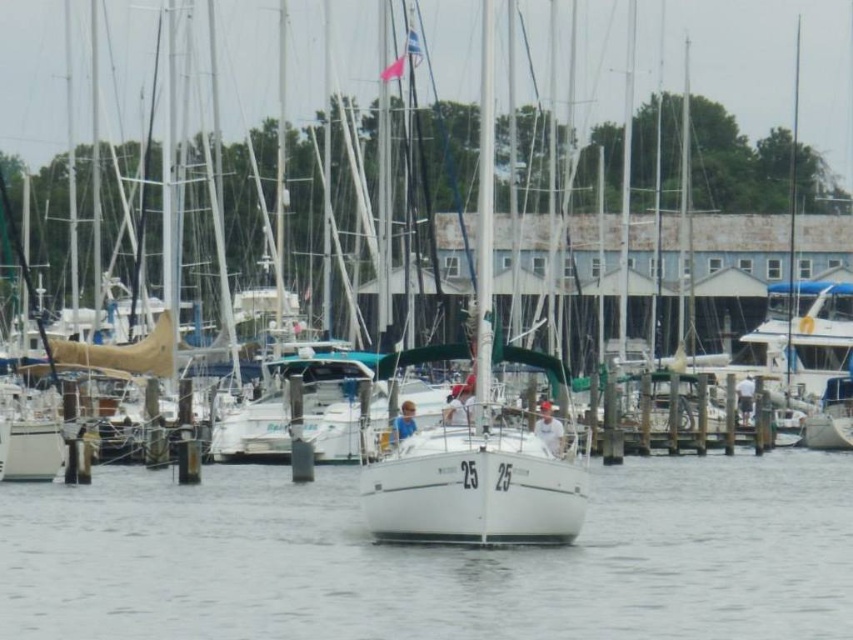
Who is lower down, white smooth water at center or white matte sailboat at center?

Positioned lower is white smooth water at center.

Describe the element at coordinates (433, 557) in the screenshot. The width and height of the screenshot is (853, 640). I see `white smooth water at center` at that location.

Is point (57, 611) closer to camera compared to point (585, 488)?

Yes.

This screenshot has height=640, width=853. I want to click on white smooth water at center, so click(x=433, y=557).